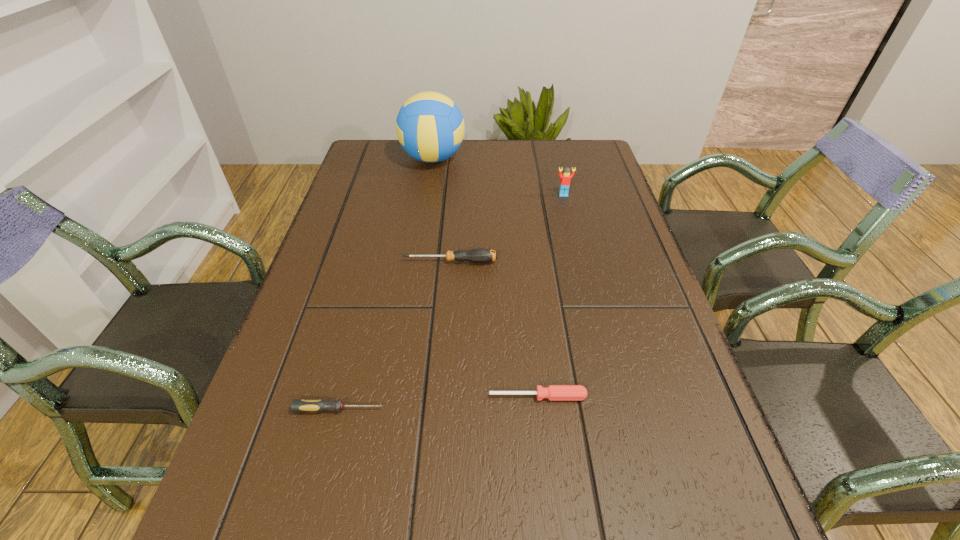
The image size is (960, 540). I want to click on free point between the third tallest object and the second nearest object, so click(x=494, y=329).

You are a GUI agent. You are given a task and a screenshot of the screen. Output one action in this format:
    pyautogui.click(x=<x>, y=<y>)
    Task: Click on the empty space between the third farthest object and the volleyball
    
    Given the screenshot: What is the action you would take?
    pyautogui.click(x=442, y=210)

Locate an element on the screen. This screenshot has height=540, width=960. object that is the third closest to the fourth farthest object is located at coordinates (565, 177).

Where is `object that is the second closest to the volleyball`? object that is the second closest to the volleyball is located at coordinates (480, 255).

Point out which screwdriver is positioned as the second nearest to the fourth shortest object. Please provide its 2D coordinates. Your answer should be formatted as a tuple, i.e. [(x, y)], where the tuple contains the x and y coordinates of a point satisfying the conditions above.

[(553, 392)]

Point out which screwdriver is positioned as the second nearest to the nearest object. Please provide its 2D coordinates. Your answer should be formatted as a tuple, i.e. [(x, y)], where the tuple contains the x and y coordinates of a point satisfying the conditions above.

[(480, 255)]

You are a GUI agent. You are given a task and a screenshot of the screen. Output one action in this format:
    pyautogui.click(x=<x>, y=<y>)
    Task: Click on the free location that satisfies the following two spatial constraints: 1. on the face of the second farthest object; 2. insert the nearest screwdriver into a screw head
    
    Given the screenshot: What is the action you would take?
    pyautogui.click(x=615, y=409)

Where is `vacant region that satisfies the following two spatial constraints: 1. on the front side of the second farthest screwdriver; 2. on the left side of the volleyball`? This screenshot has height=540, width=960. vacant region that satisfies the following two spatial constraints: 1. on the front side of the second farthest screwdriver; 2. on the left side of the volleyball is located at coordinates (396, 396).

This screenshot has height=540, width=960. I want to click on free location that satisfies the following two spatial constraints: 1. on the face of the fourth nearest object; 2. insert the nearest screwdriver into a screw head, so click(615, 409).